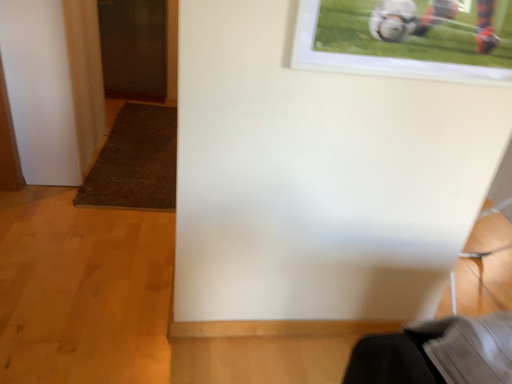
What do you see at coordinates (134, 48) in the screenshot? I see `transparent glass door at left` at bounding box center [134, 48].

Locate an element on the screen. transparent glass door at left is located at coordinates (134, 48).

Identify the location of transparent glass door at left. The height and width of the screenshot is (384, 512). (134, 48).